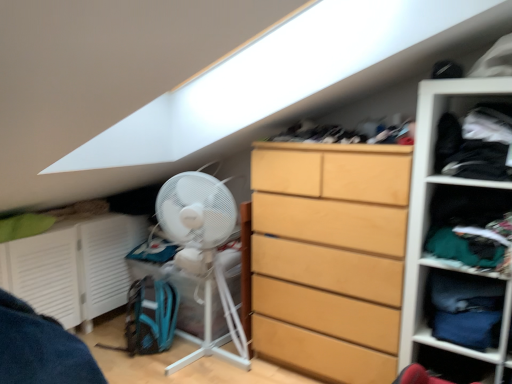
The width and height of the screenshot is (512, 384). Describe the element at coordinates (483, 144) in the screenshot. I see `dark blue fabric at upper right, which ranks as the second clothing in bottom-to-top order` at that location.

Measure the distance between dark fabric laundry at upper center and camera.

dark fabric laundry at upper center is 1.81 meters from camera.

What is the approximate height of light wood dresser at center?

light wood dresser at center is 4.10 feet in height.

Describe the element at coordinates (73, 267) in the screenshot. I see `white matte fan at lower left, the 2th cabinet positioned from the right` at that location.

In order to face white matte fan at lower left, the 2th cabinet positioned from the right, should I rotate leftwards or rightwards?

Turn left approximately 22.234 degrees to face it.

The width and height of the screenshot is (512, 384). Find the location of `white matte shelf at right`. white matte shelf at right is located at coordinates (426, 222).

Locate an element on the screen. dark green fabric drawer at right, the 1th cabinet viewed from the right is located at coordinates (465, 221).

Is white matte fan at lower left, the 2th cabinet positioned from the right, smaller than dark green fabric drawer at right, the second cabinet viewed from the back?

Actually, white matte fan at lower left, the 2th cabinet positioned from the right, might be larger than dark green fabric drawer at right, the second cabinet viewed from the back.

From a real-world perspective, is white matte fan at lower left, the first cabinet when ordered from back to front, beneath dark green fabric drawer at right, the second cabinet viewed from the back?

Yes, from a real-world perspective, white matte fan at lower left, the first cabinet when ordered from back to front, is under dark green fabric drawer at right, the second cabinet viewed from the back.

Could you measure the distance between white matte fan at lower left, the 1th cabinet in the left-to-right sequence, and dark green fabric drawer at right, the first cabinet when ordered from front to back?

white matte fan at lower left, the 1th cabinet in the left-to-right sequence, and dark green fabric drawer at right, the first cabinet when ordered from front to back, are 1.99 meters apart from each other.

Is white matte fan at lower left, the 1th cabinet in the left-to-right sequence, in front of dark green fabric drawer at right, the 1th cabinet viewed from the right?

No.

Between white matte shelf at right and dark blue fabric at right, the first clothing from the bottom, which one appears on the right side from the viewer's perspective?

Positioned to the right is white matte shelf at right.

Which object is closer to the camera, white matte shelf at right or dark blue fabric at right, which ranks as the 2th clothing in top-to-bottom order?

white matte shelf at right is more forward.

Is white matte shelf at right beside dark blue fabric at right, the first clothing from the bottom?

white matte shelf at right is not next to dark blue fabric at right, the first clothing from the bottom, and they're not touching.

Is dark green fabric drawer at right, the 1th cabinet viewed from the right, wider or thinner than dark blue fabric at right, which ranks as the 2th clothing in top-to-bottom order?

dark green fabric drawer at right, the 1th cabinet viewed from the right, is wider than dark blue fabric at right, which ranks as the 2th clothing in top-to-bottom order.

From the image's perspective, is dark green fabric drawer at right, the 1th cabinet viewed from the right, above or below dark blue fabric at right, which ranks as the 2th clothing in top-to-bottom order?

Based on their image positions, dark green fabric drawer at right, the 1th cabinet viewed from the right, is located above dark blue fabric at right, which ranks as the 2th clothing in top-to-bottom order.

Is dark green fabric drawer at right, the second cabinet viewed from the back, shorter than dark blue fabric at right, the first clothing from the bottom?

Yes, dark green fabric drawer at right, the second cabinet viewed from the back, is shorter than dark blue fabric at right, the first clothing from the bottom.

Considering the positions of objects dark green fabric drawer at right, the 1th cabinet viewed from the right, and dark blue fabric at right, the first clothing from the bottom, in the image provided, who is behind, dark green fabric drawer at right, the 1th cabinet viewed from the right, or dark blue fabric at right, the first clothing from the bottom,?

Positioned behind is dark blue fabric at right, the first clothing from the bottom.

Considering their positions, is white plastic fan at left located in front of or behind dark blue fabric at upper right, placed as the 1th clothing when sorted from top to bottom?

white plastic fan at left is behind dark blue fabric at upper right, placed as the 1th clothing when sorted from top to bottom.

Which object is thinner, white plastic fan at left or dark blue fabric at upper right, placed as the 1th clothing when sorted from top to bottom?

dark blue fabric at upper right, placed as the 1th clothing when sorted from top to bottom, is thinner.

You are a GUI agent. You are given a task and a screenshot of the screen. Output one action in this format:
    pyautogui.click(x=<x>, y=<y>)
    Task: Click on the fan below the dark blue fabric at upper right, which ranks as the second clothing in bottom-to-top order (from the image's perspective)
    This screenshot has width=512, height=384.
    Given the screenshot: What is the action you would take?
    pyautogui.click(x=203, y=253)

Is white plastic fan at left bigger than dark blue fabric at upper right, which ranks as the second clothing in bottom-to-top order?

Yes.

Which of these two, white matte fan at lower left, the 1th cabinet in the left-to-right sequence, or light wood dresser at center, stands shorter?

white matte fan at lower left, the 1th cabinet in the left-to-right sequence, is shorter.

Which is more to the left, white matte fan at lower left, the 1th cabinet in the left-to-right sequence, or light wood dresser at center?

white matte fan at lower left, the 1th cabinet in the left-to-right sequence, is more to the left.

From the image's perspective, which is above, white matte fan at lower left, the 1th cabinet in the left-to-right sequence, or light wood dresser at center?

From the image's view, light wood dresser at center is above.

Is white matte fan at lower left, the 2th cabinet positioned from the right, oriented away from light wood dresser at center?

That's not correct — white matte fan at lower left, the 2th cabinet positioned from the right, is not looking away from light wood dresser at center.

Who is smaller, white matte shelf at right or white matte fan at lower left, the first cabinet when ordered from back to front?

With smaller size is white matte shelf at right.

Considering the positions of point (471, 84) and point (70, 259), is point (471, 84) closer or farther from the camera than point (70, 259)?

Point (471, 84).

Between white matte shelf at right and white matte fan at lower left, the 2th cabinet positioned from the right, which one is positioned in front?

white matte shelf at right.

Find the location of a particular element. the 2nd cabinet behind the white matte shelf at right is located at coordinates (73, 267).

Is light wood dresser at center turned away from white matte fan at lower left, the 2th cabinet viewed from the front?

No, light wood dresser at center's orientation is not away from white matte fan at lower left, the 2th cabinet viewed from the front.

Which of these two, light wood dresser at center or white matte fan at lower left, the first cabinet when ordered from back to front, is wider?

Wider between the two is light wood dresser at center.

From the image's perspective, would you say light wood dresser at center is positioned over white matte fan at lower left, the 2th cabinet viewed from the front?

Yes, from the image's perspective, light wood dresser at center is on top of white matte fan at lower left, the 2th cabinet viewed from the front.

Where is `cabinet that is above the white matte fan at lower left, the 2th cabinet positioned from the right (from a real-world perspective)`? This screenshot has height=384, width=512. cabinet that is above the white matte fan at lower left, the 2th cabinet positioned from the right (from a real-world perspective) is located at coordinates (465, 221).

Where is `clothing lying below the white matte shelf at right (from the image's perspective)`? clothing lying below the white matte shelf at right (from the image's perspective) is located at coordinates (465, 309).

Estimate the real-world distances between objects in this image. Which object is closer to dark blue fabric at upper right, which ranks as the second clothing in bottom-to-top order, dark green fabric drawer at right, the 1th cabinet viewed from the right, or white plastic fan at left?

The object closer to dark blue fabric at upper right, which ranks as the second clothing in bottom-to-top order, is dark green fabric drawer at right, the 1th cabinet viewed from the right.

Looking at the image, which one is located closer to white matte shelf at right, white plastic fan at left or dark blue fabric at upper right, which ranks as the second clothing in bottom-to-top order?

Among the two, dark blue fabric at upper right, which ranks as the second clothing in bottom-to-top order, is located nearer to white matte shelf at right.

Looking at the image, which one is located closer to white matte shelf at right, dark blue fabric at upper right, which ranks as the second clothing in bottom-to-top order, or dark green fabric drawer at right, the first cabinet when ordered from front to back?

Among the two, dark green fabric drawer at right, the first cabinet when ordered from front to back, is located nearer to white matte shelf at right.

Based on their spatial positions, is white matte fan at lower left, the 2th cabinet viewed from the front, or white matte shelf at right closer to dark green fabric drawer at right, the second cabinet viewed from the back?

white matte shelf at right is closer to dark green fabric drawer at right, the second cabinet viewed from the back.

Estimate the real-world distances between objects in this image. Which object is further from dark blue fabric at right, which ranks as the 2th clothing in top-to-bottom order, white matte shelf at right or white matte fan at lower left, the 2th cabinet viewed from the front?

white matte fan at lower left, the 2th cabinet viewed from the front, lies further to dark blue fabric at right, which ranks as the 2th clothing in top-to-bottom order, than the other object.

Looking at the image, which one is located closer to white matte shelf at right, dark blue fabric at upper right, which ranks as the second clothing in bottom-to-top order, or dark fabric laundry at upper center?

The object closer to white matte shelf at right is dark blue fabric at upper right, which ranks as the second clothing in bottom-to-top order.

When comparing their distances from white matte shelf at right, does white matte fan at lower left, the 1th cabinet in the left-to-right sequence, or white plastic fan at left seem further?

white matte fan at lower left, the 1th cabinet in the left-to-right sequence, lies further to white matte shelf at right than the other object.

Estimate the real-world distances between objects in this image. Which object is further from dark blue fabric at right, the first clothing from the bottom, dark fabric laundry at upper center or white matte shelf at right?

dark fabric laundry at upper center.

Locate an element on the screen. The height and width of the screenshot is (384, 512). shelf between dark blue fabric at upper right, which ranks as the second clothing in bottom-to-top order, and dark blue fabric at right, the first clothing from the bottom, vertically is located at coordinates (426, 222).

This screenshot has height=384, width=512. Find the location of `chest of drawers between dark blue fabric at upper right, placed as the 1th clothing when sorted from top to bottom, and dark blue fabric at right, the first clothing from the bottom, in the up-down direction`. chest of drawers between dark blue fabric at upper right, placed as the 1th clothing when sorted from top to bottom, and dark blue fabric at right, the first clothing from the bottom, in the up-down direction is located at coordinates (329, 256).

I want to click on shelf between dark fabric laundry at upper center and light wood dresser at center in the up-down direction, so click(x=426, y=222).

Identify the location of laundry between white matte fan at lower left, the 2th cabinet viewed from the front, and dark blue fabric at right, the first clothing from the bottom. The image size is (512, 384). click(348, 134).